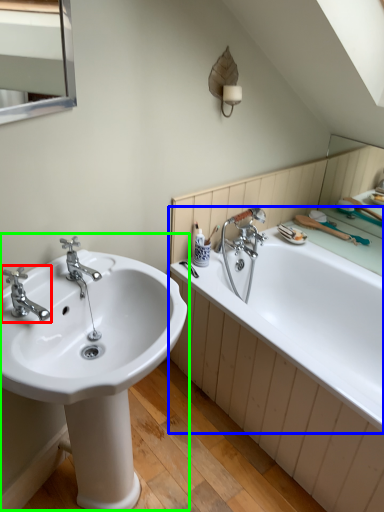
Question: Considering the real-world distances, which object is closest to tap (highlighted by a red box)? bathtub (highlighted by a blue box) or sink (highlighted by a green box).

Choices:
 (A) bathtub
 (B) sink

Answer: (B)